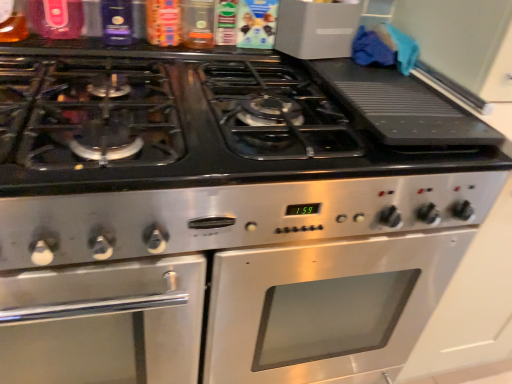
Question: In the image, is stainless steel gas stove at center positioned in front of or behind stainless steel oven at center?

Choices:
 (A) behind
 (B) front

Answer: (B)

Question: Considering the positions of stainless steel gas stove at center and stainless steel oven at center in the image, is stainless steel gas stove at center bigger or smaller than stainless steel oven at center?

Choices:
 (A) big
 (B) small

Answer: (B)

Question: Does point (117, 82) appear closer or farther from the camera than point (0, 279)?

Choices:
 (A) closer
 (B) farther

Answer: (B)

Question: From the image's perspective, is stainless steel oven at center located above or below stainless steel gas stove at center?

Choices:
 (A) below
 (B) above

Answer: (A)

Question: In terms of height, does stainless steel oven at center look taller or shorter compared to stainless steel gas stove at center?

Choices:
 (A) tall
 (B) short

Answer: (A)

Question: Considering their positions, is stainless steel oven at center located in front of or behind stainless steel gas stove at center?

Choices:
 (A) behind
 (B) front

Answer: (A)

Question: Does point (330, 322) appear closer or farther from the camera than point (56, 122)?

Choices:
 (A) farther
 (B) closer

Answer: (A)